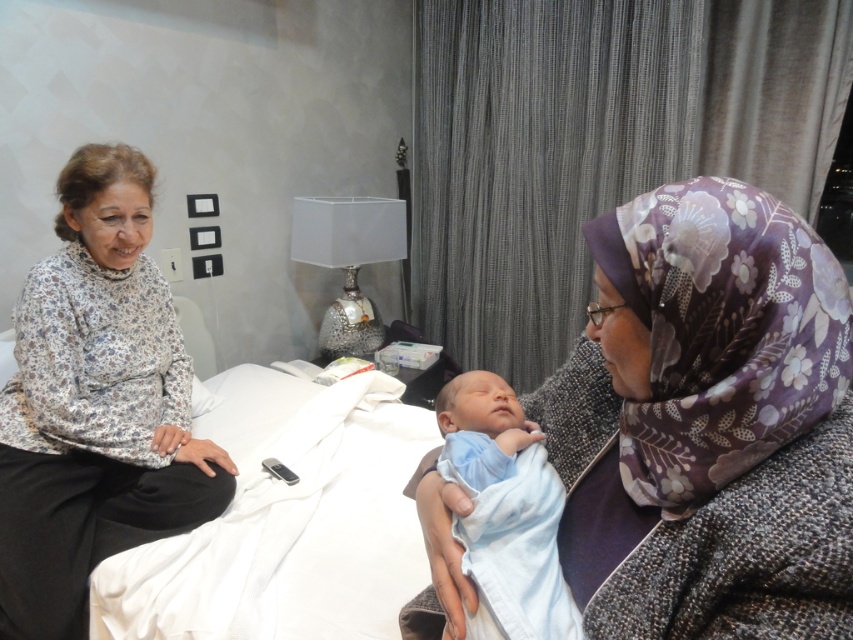
Is floral-patterned fabric at left positioned in front of white fabric bed at center?

No, it is behind white fabric bed at center.

Consider the image. Who is shorter, floral-patterned fabric at left or white fabric bed at center?

white fabric bed at center is shorter.

What do you see at coordinates (96, 404) in the screenshot?
I see `floral-patterned fabric at left` at bounding box center [96, 404].

Find the location of a particular element. This screenshot has height=640, width=853. floral-patterned fabric at left is located at coordinates (96, 404).

Does white fabric bed at center have a lesser height compared to blue soft fabric baby at center?

Incorrect, white fabric bed at center's height does not fall short of blue soft fabric baby at center's.

Between white fabric bed at center and blue soft fabric baby at center, which one appears on the right side from the viewer's perspective?

From the viewer's perspective, blue soft fabric baby at center appears more on the right side.

The width and height of the screenshot is (853, 640). I want to click on white fabric bed at center, so click(286, 522).

Does purple floral headscarf at upper right have a greater height compared to white fabric bed at center?

Indeed, purple floral headscarf at upper right has a greater height compared to white fabric bed at center.

Who is taller, purple floral headscarf at upper right or white fabric bed at center?

With more height is purple floral headscarf at upper right.

Does point (775, 314) lie in front of point (352, 493)?

Yes, it is in front of point (352, 493).

This screenshot has height=640, width=853. In order to click on purple floral headscarf at upper right in this screenshot , I will do `click(706, 422)`.